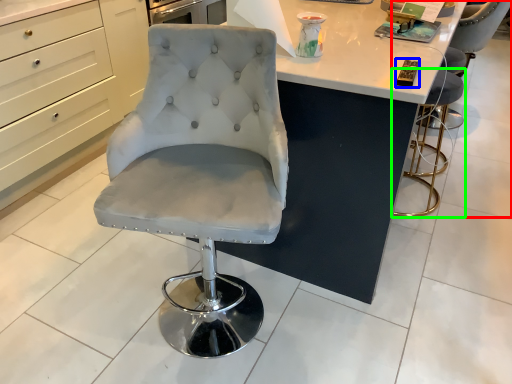
Question: Which object is the closest to the chair (highlighted by a red box)? Choose among these: magazine (highlighted by a blue box) or chair (highlighted by a green box).

Choices:
 (A) magazine
 (B) chair

Answer: (B)